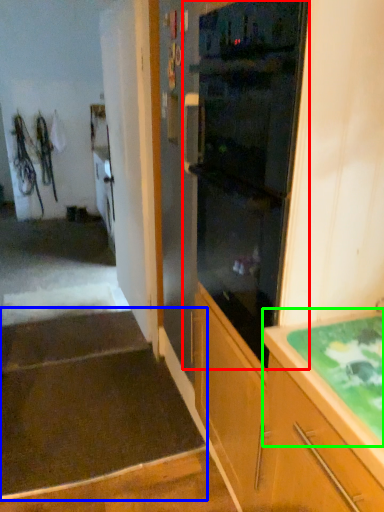
Question: Which object is the farthest from home appliance (highlighted by a red box)? Choose among these: stairwell (highlighted by a blue box) or countertop (highlighted by a green box).

Choices:
 (A) stairwell
 (B) countertop

Answer: (A)